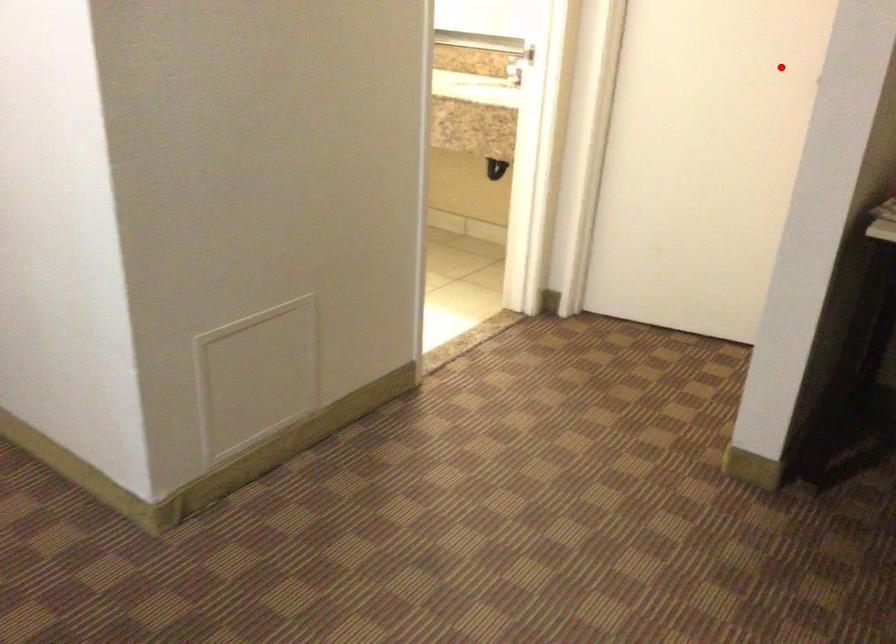
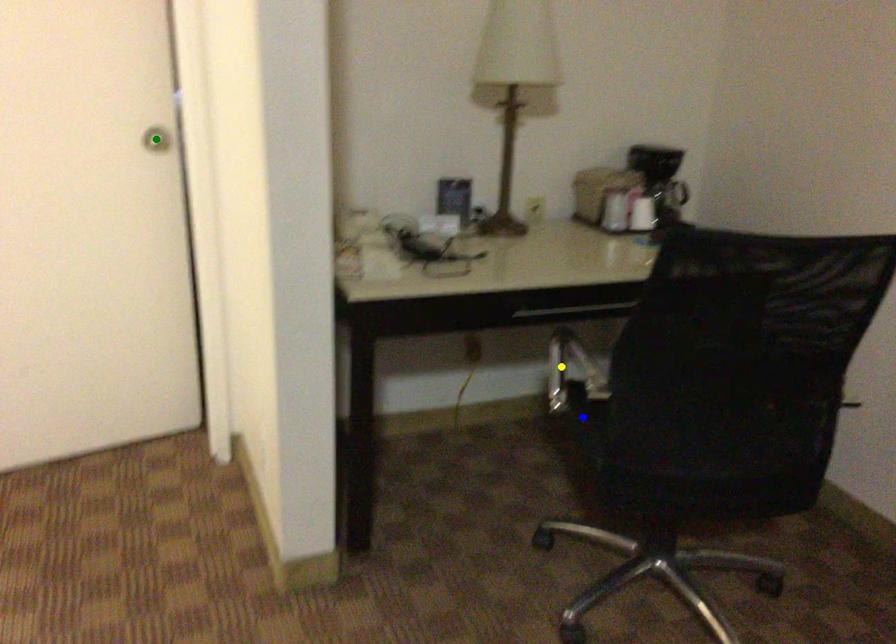
Question: I am providing you with two images of the same scene from different viewpoints. A red point is marked on the first image. You are given multiple points on the second image. In image 2, which mark is for the same physical point as the one in image 1?

Choices:
 (A) green point
 (B) blue point
 (C) yellow point

Answer: (A)